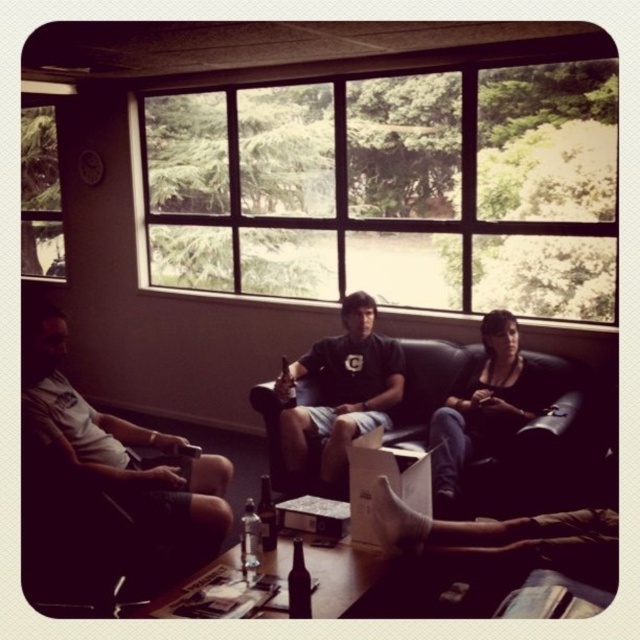
Who is positioned more to the left, matte white shorts at left or black leather couch at center?

From the viewer's perspective, matte white shorts at left appears more on the left side.

Does point (100, 433) come farther from viewer compared to point (589, 435)?

No, (100, 433) is in front of (589, 435).

Image resolution: width=640 pixels, height=640 pixels. I want to click on matte white shorts at left, so click(x=120, y=464).

Is matte black shirt at center positioned at the back of clear glass bottle at center?

Yes, matte black shirt at center is behind clear glass bottle at center.

Is matte black shirt at center above clear glass bottle at center?

Correct, matte black shirt at center is located above clear glass bottle at center.

The width and height of the screenshot is (640, 640). I want to click on matte black shirt at center, so click(340, 392).

Between transparent glass window at upper left and clear glass bottle at center, which one is positioned higher?

Positioned higher is transparent glass window at upper left.

Is point (24, 131) positioned behind point (246, 547)?

Yes, point (24, 131) is behind point (246, 547).

Does point (48, 276) come closer to viewer compared to point (244, 524)?

No.

Locate an element on the screen. transparent glass window at upper left is located at coordinates (40, 195).